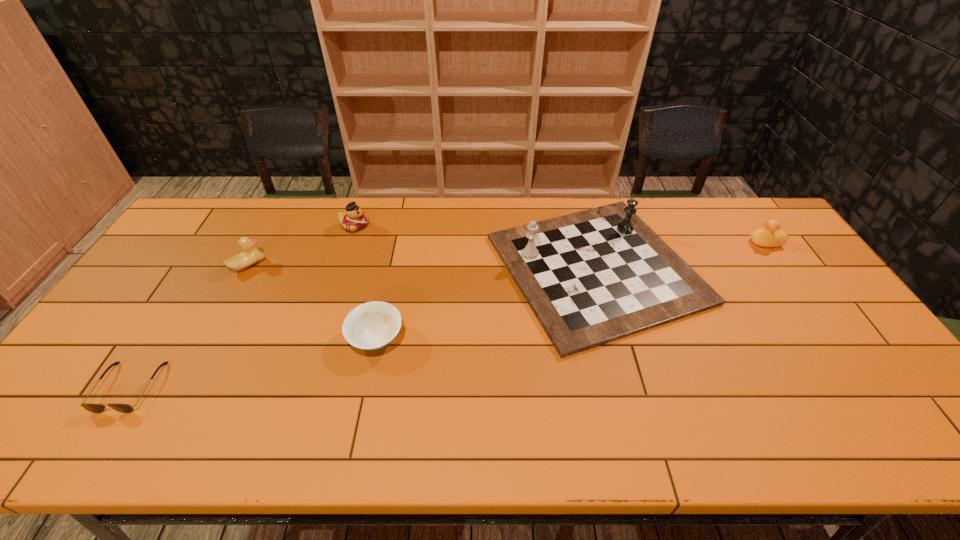
Identify the location of gameboard present at the far edge. This screenshot has height=540, width=960. tap(592, 277).

Find the location of `object that is at the left edge`. object that is at the left edge is located at coordinates (92, 407).

The image size is (960, 540). I want to click on object that is at the right edge, so click(765, 237).

What are the coordinates of `object present at the far right corner` in the screenshot? It's located at (765, 237).

You are a GUI agent. You are given a task and a screenshot of the screen. Output one action in this format:
    pyautogui.click(x=<x>, y=<y>)
    Task: Click on the vacant space at the far edge of the desktop
    The image size is (960, 540).
    Given the screenshot: What is the action you would take?
    pos(700,226)

What are the coordinates of `blank space at the near edge of the desktop` in the screenshot? It's located at (180, 418).

This screenshot has height=540, width=960. In the image, there is a desktop. What are the coordinates of `vacant region at the left edge` in the screenshot? It's located at (76, 377).

The height and width of the screenshot is (540, 960). In the image, there is a desktop. What are the coordinates of `vacant space at the right edge` in the screenshot? It's located at (855, 388).

You are a GUI agent. You are given a task and a screenshot of the screen. Output one action in this format:
    pyautogui.click(x=<x>, y=<y>)
    Task: Click on the free region at the far left corner of the desktop
    The width and height of the screenshot is (960, 540).
    Given the screenshot: What is the action you would take?
    pyautogui.click(x=198, y=230)

The width and height of the screenshot is (960, 540). Identify the location of vacant space at the near right corner of the desktop. (883, 447).